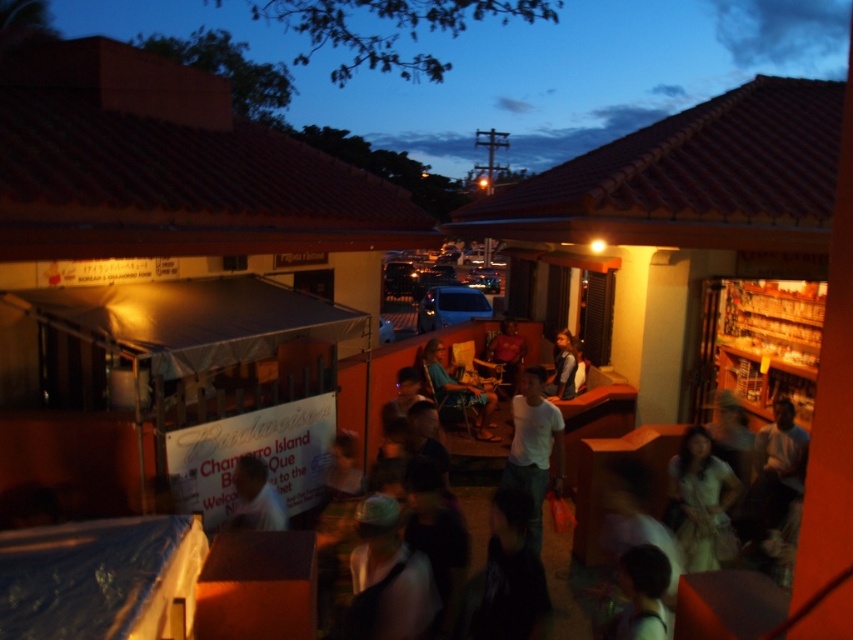
You are at the event and want to take a photo of both the white fabric dress at lower right and the matte white signboard at center. Which object should you focus on first to ensure both are in the frame?

You should focus on the white fabric dress at lower right first because it might be wider than the matte white signboard at center, so capturing it first ensures there is enough space in the frame for both.